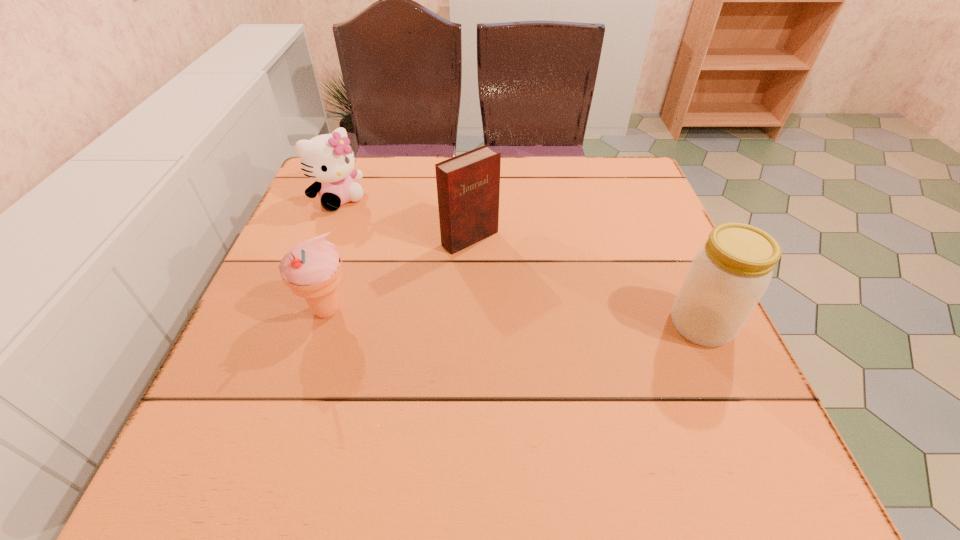
Find the location of a particular element. The image size is (960, 540). vacant space on the desktop that is between the icecream and the rightmost object and is positioned on the front-facing side of the farthest object is located at coordinates (456, 315).

Find the location of a particular element. This screenshot has width=960, height=540. vacant space on the desktop that is between the icecream and the rightmost object and is positioned on the front cover of the second farthest object is located at coordinates (564, 319).